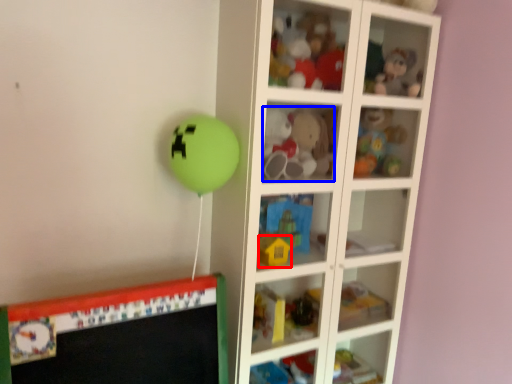
Question: Which of the following is the farthest to the observer, toy (highlighted by a red box) or toy (highlighted by a blue box)?

Choices:
 (A) toy
 (B) toy

Answer: (B)